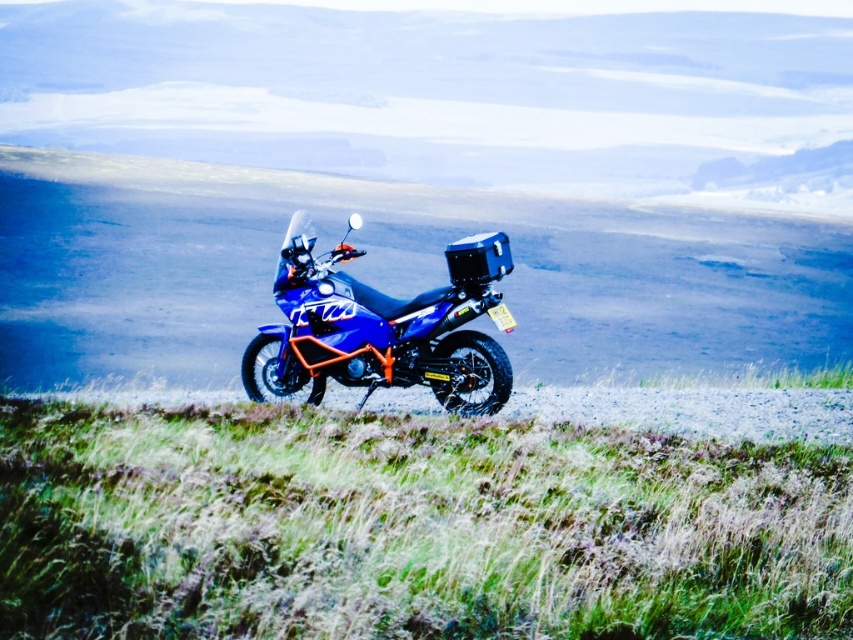
Who is more distant from viewer, (712,573) or (465,253)?

The point (465,253) is behind.

Is green grassy at center smaller than blue matte motorcycle at center?

Indeed, green grassy at center has a smaller size compared to blue matte motorcycle at center.

Where is `green grassy at center`? green grassy at center is located at coordinates (409, 528).

Locate an element on the screen. The height and width of the screenshot is (640, 853). green grassy at center is located at coordinates (409, 528).